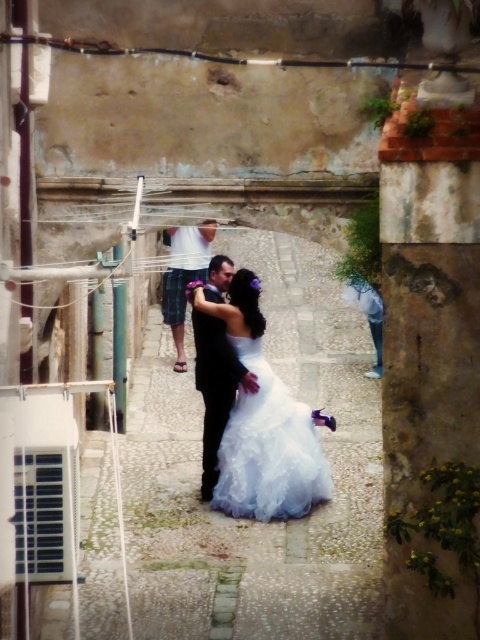
You are a photographer positioned at the entrance of the alleyway. You need to capture a photo of both the white satin dress at center and the black satin suit at center. Which one is positioned to the right of the other?

The white satin dress at center is positioned to the right of the black satin suit at center.